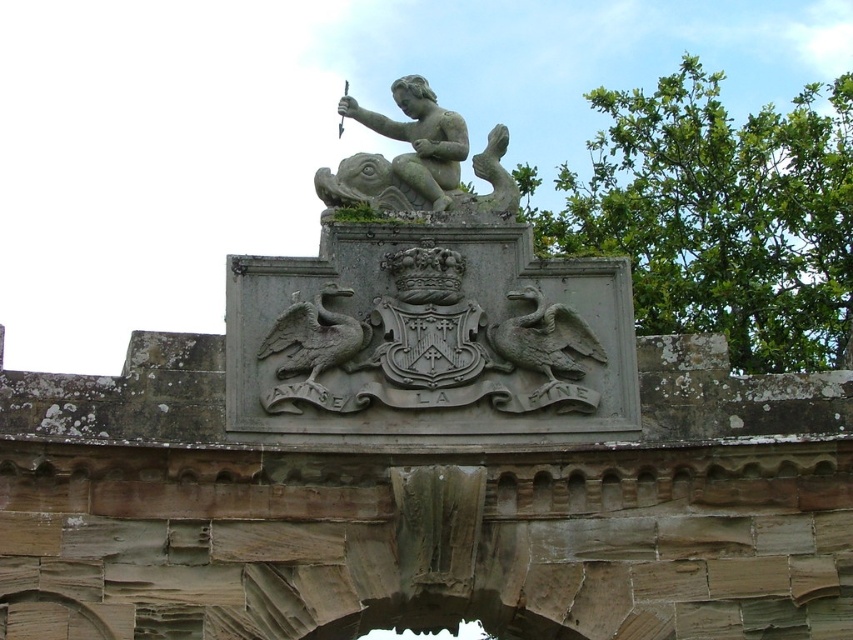
Question: Which point is farther from the camera taking this photo?

Choices:
 (A) (589, 355)
 (B) (279, 342)

Answer: (A)

Question: Among these points, which one is nearest to the camera?

Choices:
 (A) (375, 196)
 (B) (335, 355)

Answer: (B)

Question: Is carved stone duck at center to the left of gray stone griffin at center from the viewer's perspective?

Choices:
 (A) no
 (B) yes

Answer: (A)

Question: Does carved stone duck at center have a lesser width compared to gray stone griffin at center?

Choices:
 (A) yes
 (B) no

Answer: (B)

Question: Does gray stone cherub at center appear over carved stone duck at center?

Choices:
 (A) yes
 (B) no

Answer: (A)

Question: Which point is closer to the camera taking this photo?

Choices:
 (A) (529, 396)
 (B) (277, 316)
 (C) (440, 150)

Answer: (A)